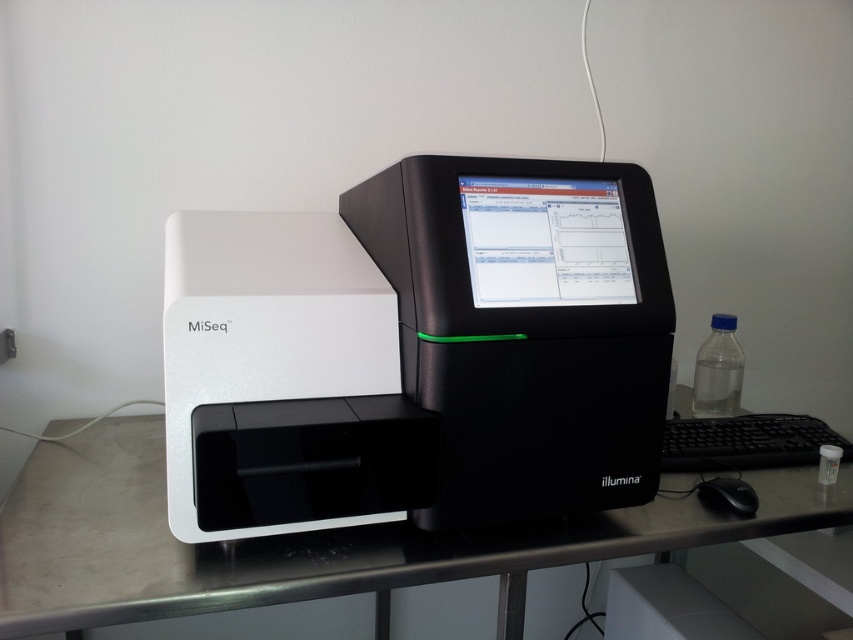
Is point (335, 396) less distant than point (587, 182)?

Yes, point (335, 396) is closer to viewer.

Is point (664, 381) farther from camera compared to point (489, 300)?

That is True.

Locate an element on the screen. The width and height of the screenshot is (853, 640). white plastic printer at center is located at coordinates (421, 353).

The width and height of the screenshot is (853, 640). In order to click on transparent plastic bottle at right in this screenshot , I will do `click(718, 371)`.

Can you confirm if transparent plastic bottle at right is positioned to the right of black plastic mouse at lower right?

Correct, you'll find transparent plastic bottle at right to the right of black plastic mouse at lower right.

Measure the distance between point (708,410) and camera.

1.32 meters

This screenshot has height=640, width=853. In order to click on transparent plastic bottle at right in this screenshot , I will do `click(718, 371)`.

Based on the photo, who is lower down, metallic silver computer desk at center or black plastic mouse at lower right?

metallic silver computer desk at center is lower down.

Can you confirm if metallic silver computer desk at center is positioned above black plastic mouse at lower right?

No.

Is point (149, 476) positioned after point (722, 488)?

Yes.

This screenshot has width=853, height=640. I want to click on metallic silver computer desk at center, so click(x=305, y=541).